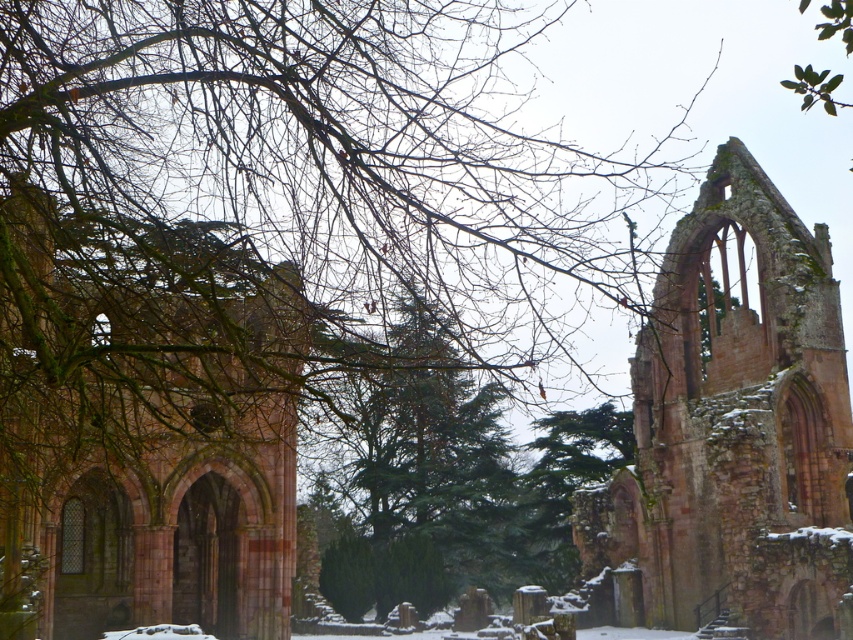
Can you confirm if rustic stone arches at center is positioned below rustic stone ruins at center?

Actually, rustic stone arches at center is above rustic stone ruins at center.

Who is positioned more to the left, rustic stone arches at center or rustic stone ruins at center?

rustic stone arches at center is more to the left.

What do you see at coordinates (146, 419) in the screenshot? I see `rustic stone arches at center` at bounding box center [146, 419].

Find the location of a particular element. rustic stone arches at center is located at coordinates (146, 419).